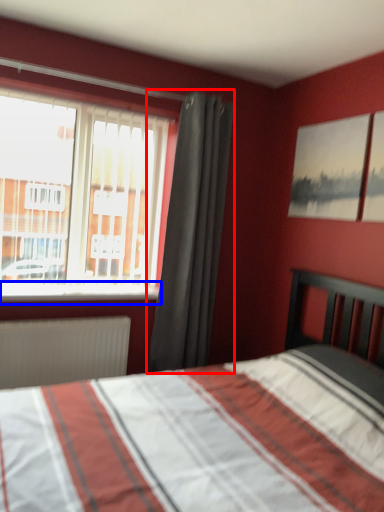
Question: Which object is further to the camera taking this photo, curtain (highlighted by a red box) or window sill (highlighted by a blue box)?

Choices:
 (A) curtain
 (B) window sill

Answer: (A)